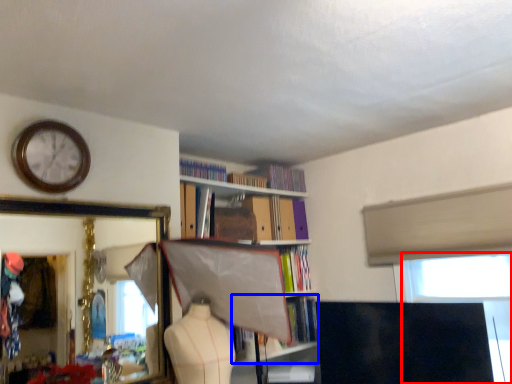
Question: Which of the following is the farthest to the observer, window screen (highlighted by a red box) or book (highlighted by a blue box)?

Choices:
 (A) window screen
 (B) book

Answer: (B)